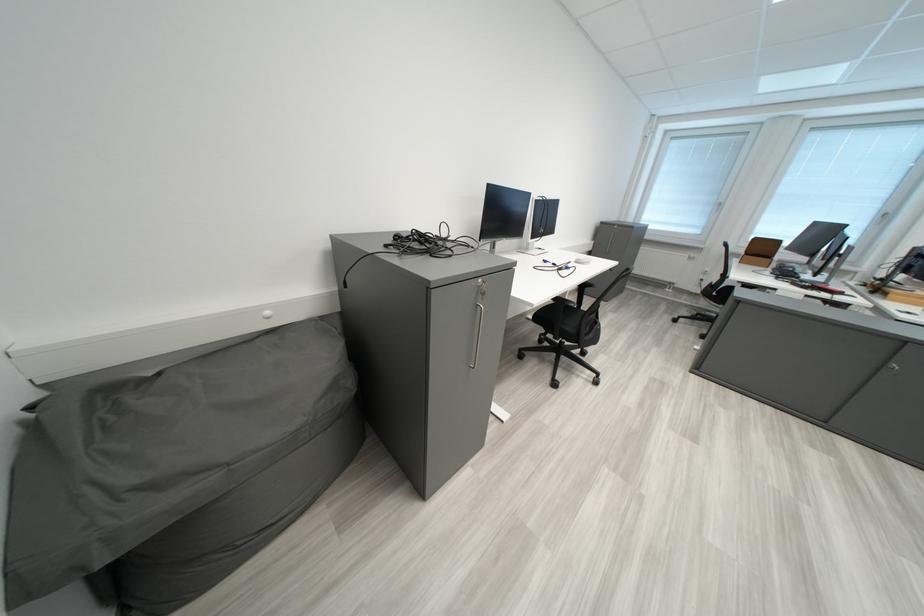
Find the location of a particular element. This screenshot has height=616, width=924. black chair armrest is located at coordinates (564, 302).